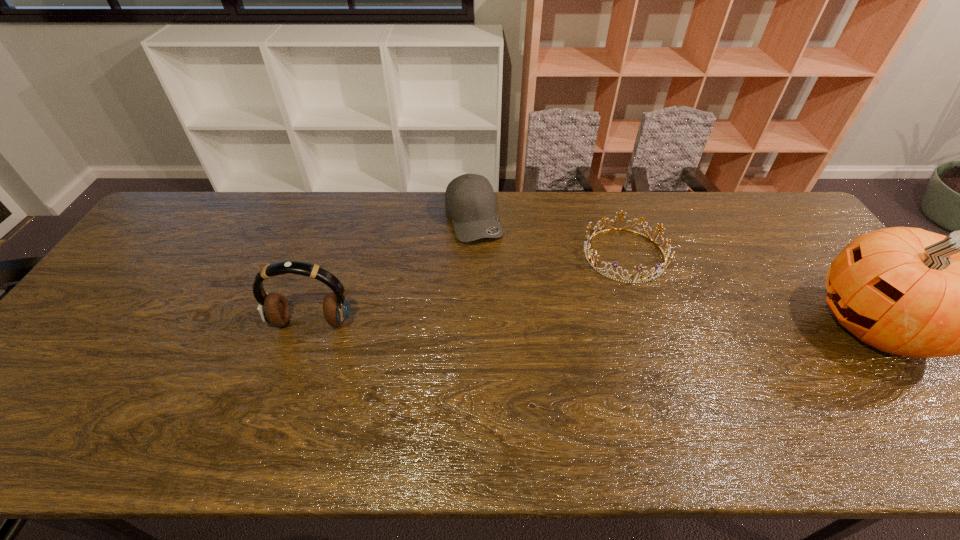
Locate an element on the screen. free space on the desktop that is between the headset and the pumpkin and is positioned on the front brim of the third tallest object is located at coordinates (516, 323).

The height and width of the screenshot is (540, 960). In order to click on free space on the desktop that is between the leftmost object and the pumpkin and is positioned on the front-facing side of the second object from right to left in this screenshot , I will do `click(644, 323)`.